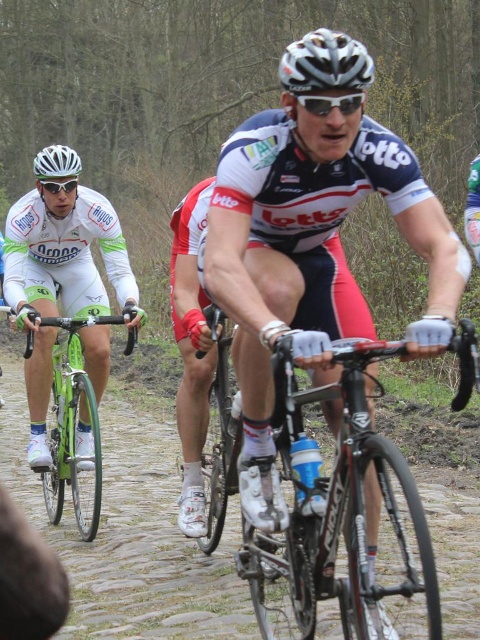
Question: Does green glossy bicycle at left lie behind white matte helmet at upper left?

Choices:
 (A) yes
 (B) no

Answer: (B)

Question: Where is shiny black frame at center located in relation to white matte helmet at upper left in the image?

Choices:
 (A) left
 (B) right

Answer: (B)

Question: Which is nearer to the white matte helmet at center?

Choices:
 (A) shiny metallic bicycle at center
 (B) shiny black frame at center
 (C) white matte bicycle helmet at upper left
 (D) white matte helmet at upper left

Answer: (B)

Question: Where is white matte bicycle helmet at center located in relation to white matte helmet at upper left in the image?

Choices:
 (A) left
 (B) right

Answer: (B)

Question: Which of the following is the farthest from the observer?

Choices:
 (A) white matte bicycle helmet at upper left
 (B) white matte helmet at center
 (C) shiny metallic bicycle at center

Answer: (A)

Question: Which point appears closest to the camera in this image?

Choices:
 (A) (63, 154)
 (B) (464, 352)
 (C) (60, 145)

Answer: (B)